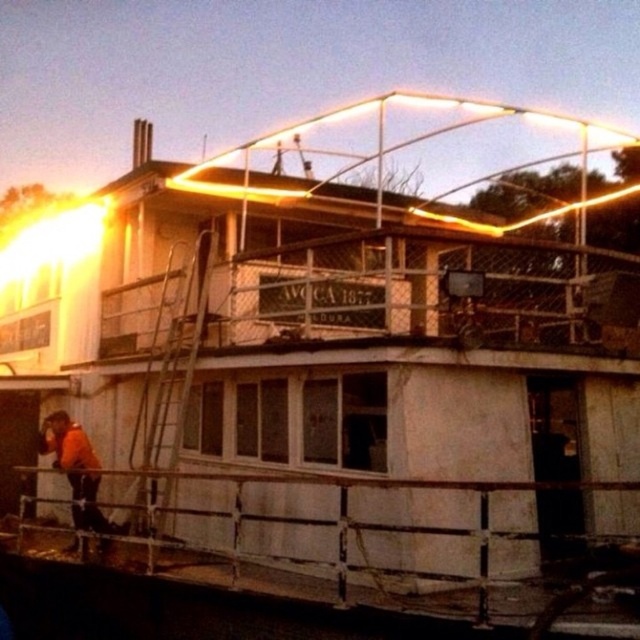
You are standing on the upper deck of the houseboat and need to retrieve your camera from the lower deck. The metallic silver ladder at left is the only access point between the two decks. If you descend the ladder, will you be able to reach your camera without moving more than 22.75 feet from the ladder?

The metallic silver ladder at left and camera are 22.75 feet apart, so if you descend the ladder and move directly to the camera, you will be exactly 22.75 feet away from the ladder, which is within the specified distance.

You are a maintenance worker needing to climb the metallic silver ladder at left to reach the upper deck. Considering the ladder is narrower than the orange fabric construction worker at lower left, will you have enough space to climb it safely?

The metallic silver ladder at left is narrower than the orange fabric construction worker at lower left, so the ladder may not provide enough width for safe climbing. It is recommended to use caution or seek a wider ladder for safety.

Looking at this image, you are standing on the lower deck of the houseboat and want to reach the upper deck. There is a metallic silver ladder at left and an orange fabric construction worker at lower left. Which object is closer to your current position?

The orange fabric construction worker at lower left is closer to your current position because the metallic silver ladder at left is to the right of the orange fabric construction worker at lower left, meaning the ladder is further away from the starting point on the lower deck.